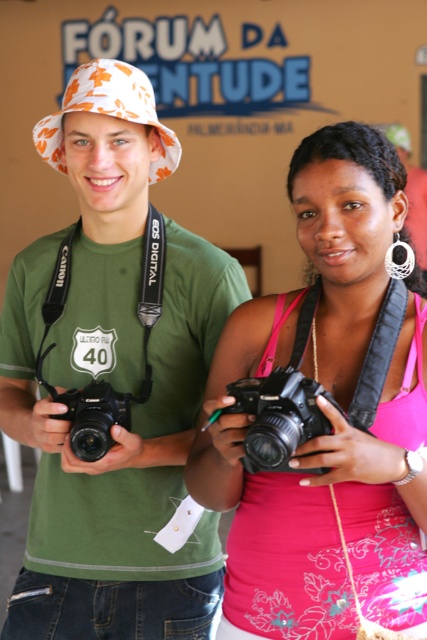
What is the significance of the point marked at coordinates (114,381) in the image?

The point marked at coordinates (114,381) indicates the location of the matte green tshirt at center in the image.

What is located at the coordinates point (280, 417)?

At point (280, 417) lies a black plastic camera at center.